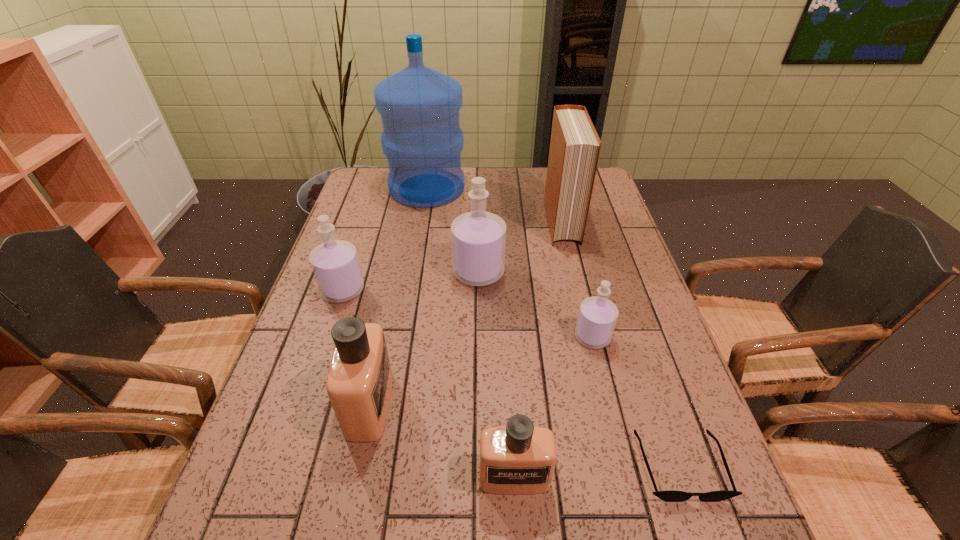
Where is `vacant area at the left edge`? The image size is (960, 540). vacant area at the left edge is located at coordinates (353, 202).

Identify the location of vacant space at the right edge of the desktop. This screenshot has width=960, height=540. (658, 325).

Where is `free area in between the blue water jug and the smaller beige perfume`? The width and height of the screenshot is (960, 540). free area in between the blue water jug and the smaller beige perfume is located at coordinates (470, 333).

You are a GUI agent. You are given a task and a screenshot of the screen. Output one action in this format:
    pyautogui.click(x=<x>, y=<y>)
    Task: Click on the unoccupied area between the hardback book and the water jug
    The width and height of the screenshot is (960, 540).
    Given the screenshot: What is the action you would take?
    pyautogui.click(x=494, y=205)

Image resolution: width=960 pixels, height=540 pixels. Find the location of `free space between the smaller beige perfume and the shortest object`. free space between the smaller beige perfume and the shortest object is located at coordinates (597, 471).

Image resolution: width=960 pixels, height=540 pixels. Find the location of `empty space between the leftmost purple perfume and the tallest perfume`. empty space between the leftmost purple perfume and the tallest perfume is located at coordinates (411, 281).

Where is `empty space that is in between the rightmost purple perfume and the blue water jug`? The width and height of the screenshot is (960, 540). empty space that is in between the rightmost purple perfume and the blue water jug is located at coordinates (510, 262).

Where is `free space between the third nearest perfume and the bigger beige perfume`? Image resolution: width=960 pixels, height=540 pixels. free space between the third nearest perfume and the bigger beige perfume is located at coordinates (481, 370).

Where is `free space between the nearest perfume and the black sunglasses`? The width and height of the screenshot is (960, 540). free space between the nearest perfume and the black sunglasses is located at coordinates (597, 471).

At what (x,y) coordinates should I click in order to perform the action: click on unoccupied area between the hardback book and the second purple perfume from right to left. Please return your answer as a coordinate pair (x, y). The height and width of the screenshot is (540, 960). Looking at the image, I should click on (520, 247).